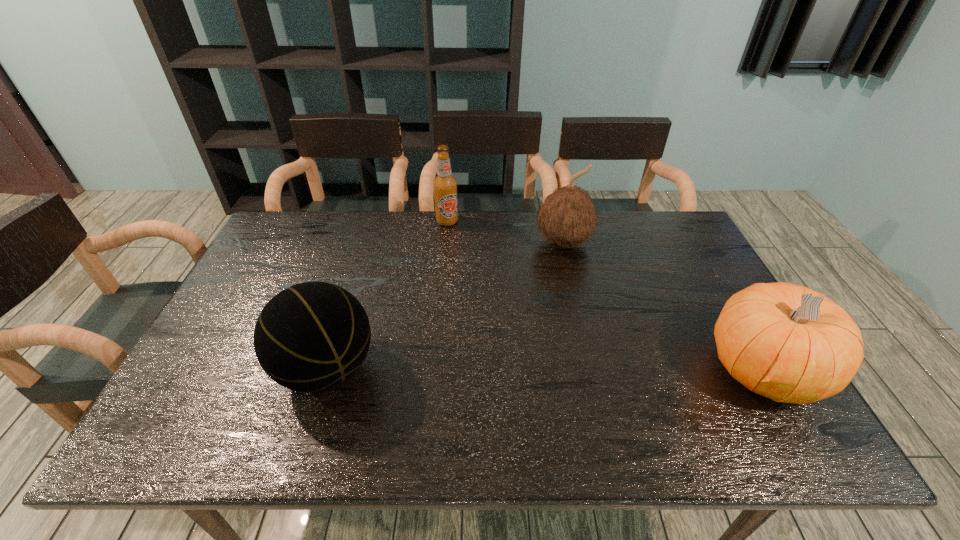
The width and height of the screenshot is (960, 540). Find the location of `free space located 0.300m on the front label of the beer bottle`. free space located 0.300m on the front label of the beer bottle is located at coordinates (469, 286).

The width and height of the screenshot is (960, 540). Find the location of `coconut positioned at the far edge`. coconut positioned at the far edge is located at coordinates (567, 217).

Locate an element on the screen. The width and height of the screenshot is (960, 540). beer bottle located at the far edge is located at coordinates (445, 185).

Locate an element on the screen. The image size is (960, 540). basketball that is at the near edge is located at coordinates (309, 338).

This screenshot has width=960, height=540. Identify the location of pumpkin at the near edge. (786, 342).

Find the location of a particular element. The width and height of the screenshot is (960, 540). object that is at the right edge is located at coordinates (786, 342).

I want to click on object positioned at the near right corner, so click(x=786, y=342).

Identify the location of vacant space at the far edge. The width and height of the screenshot is (960, 540). (601, 253).

The image size is (960, 540). I want to click on free space at the near edge of the desktop, so click(637, 394).

This screenshot has height=540, width=960. In the image, there is a desktop. Identify the location of free region at the right edge. (722, 302).